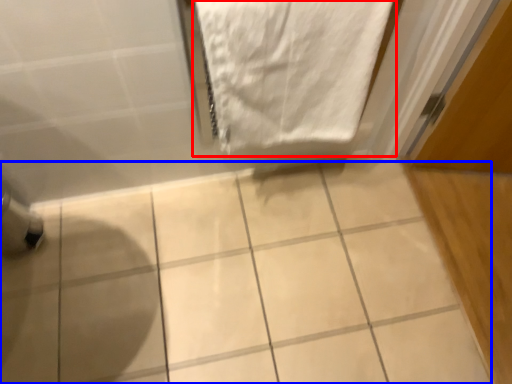
Question: Among these objects, which one is nearest to the camera, towel (highlighted by a red box) or ceramic tile (highlighted by a blue box)?

Choices:
 (A) towel
 (B) ceramic tile

Answer: (A)